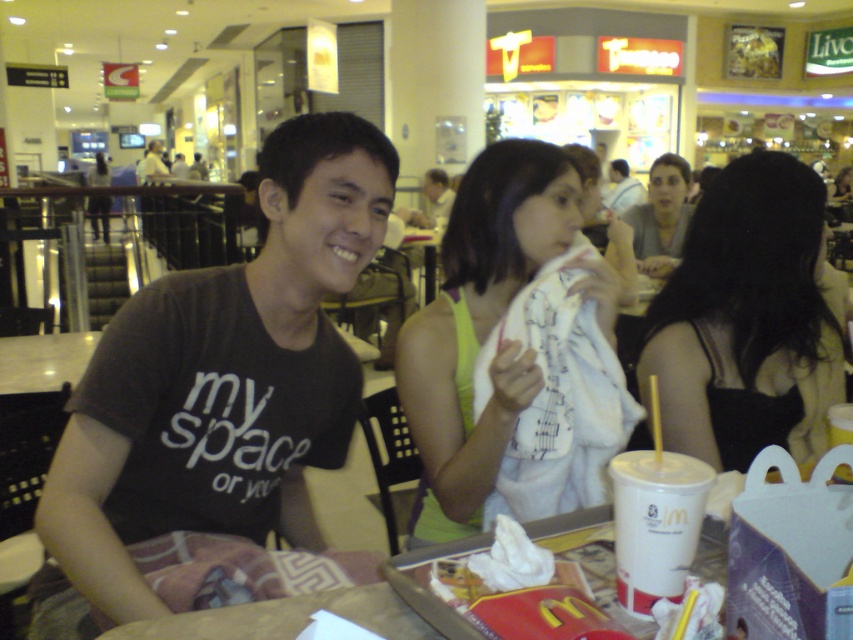
Who is more distant from viewer, [758,168] or [688,170]?

The point [688,170] is more distant.

Is point (697, 237) less distant than point (689, 216)?

Yes, point (697, 237) is closer to viewer.

Who is more distant from viewer, [779,156] or [640,257]?

The point [640,257] is behind.

This screenshot has width=853, height=640. In order to click on black fabric dress at center in this screenshot , I will do `click(746, 321)`.

Is black fabric dress at center smaller than matte black shirt at upper center?

Yes.

Describe the element at coordinates (746, 321) in the screenshot. I see `black fabric dress at center` at that location.

Which is behind, point (813, 458) or point (616, 170)?

Positioned behind is point (616, 170).

The image size is (853, 640). In order to click on black fabric dress at center in this screenshot , I will do `click(746, 321)`.

Who is positioned more to the left, black fabric dress at center or white fabric at center?

white fabric at center is more to the left.

Is point (694, 276) less distant than point (451, 456)?

No, it is not.

This screenshot has height=640, width=853. What do you see at coordinates (746, 321) in the screenshot?
I see `black fabric dress at center` at bounding box center [746, 321].

The image size is (853, 640). What are the coordinates of `black fabric dress at center` in the screenshot? It's located at (746, 321).